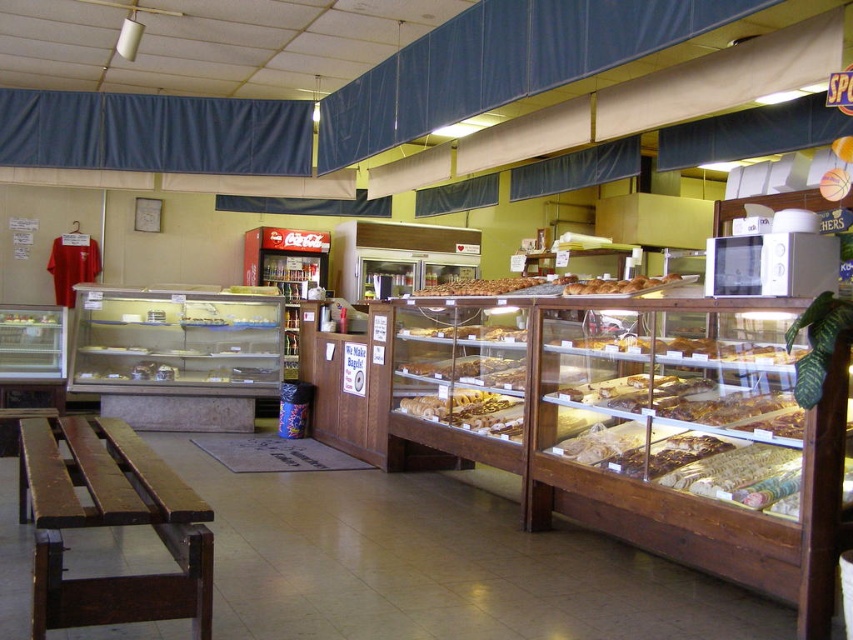
Question: Which point is closer to the camera taking this photo?

Choices:
 (A) (589, 294)
 (B) (488, 280)

Answer: (A)

Question: Can you confirm if brown matte bread at center is positioned above golden brown bread at center?

Choices:
 (A) no
 (B) yes

Answer: (B)

Question: Is the position of brown matte bread at center more distant than that of golden brown bread at center?

Choices:
 (A) yes
 (B) no

Answer: (A)

Question: Considering the relative positions of brown matte bread at center and golden brown bread at center in the image provided, where is brown matte bread at center located with respect to golden brown bread at center?

Choices:
 (A) above
 (B) below

Answer: (A)